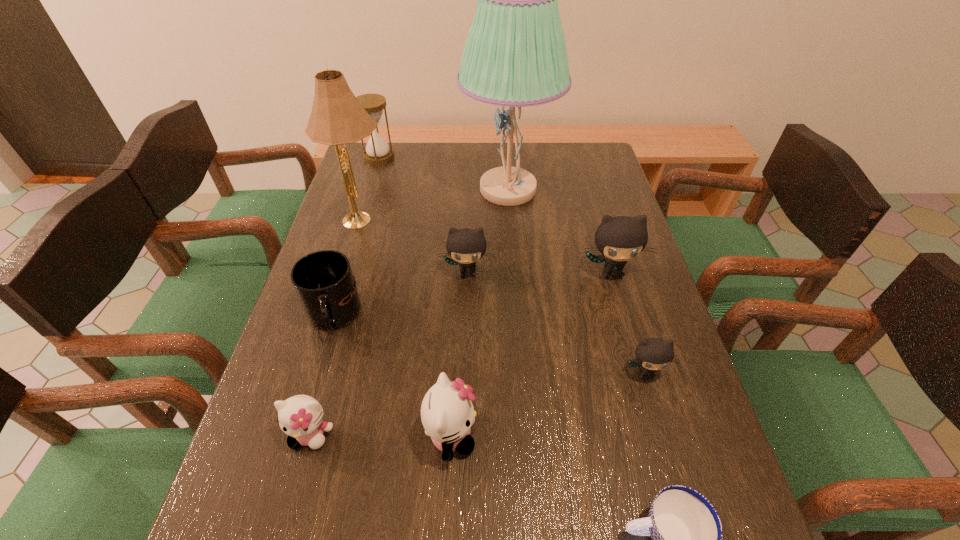
Where is `vacant region located with the handle on the side of the black mug`? vacant region located with the handle on the side of the black mug is located at coordinates (313, 384).

You are a GUI agent. You are given a task and a screenshot of the screen. Output one action in this format:
    pyautogui.click(x=<x>, y=<y>)
    Task: Click on the vacant space located on the front-facing side of the smaller white kitten
    
    Given the screenshot: What is the action you would take?
    pyautogui.click(x=297, y=485)

The height and width of the screenshot is (540, 960). In order to click on vacant space located on the front-facing side of the smallest gray kitten in this screenshot , I will do pos(660,425).

You are a GUI agent. You are given a task and a screenshot of the screen. Output one action in this format:
    pyautogui.click(x=<x>, y=<y>)
    Task: Click on the lamp positioned at the far edge
    This screenshot has height=540, width=960.
    Given the screenshot: What is the action you would take?
    pyautogui.click(x=515, y=55)

This screenshot has height=540, width=960. Identify the location of hourglass that is at the far edge. (377, 152).

Where is `lampshade present at the left edge`? The image size is (960, 540). lampshade present at the left edge is located at coordinates (337, 117).

Locate an element on the screen. The height and width of the screenshot is (540, 960). hourglass located at the left edge is located at coordinates (377, 152).

Image resolution: width=960 pixels, height=540 pixels. Identify the location of mug present at the left edge. (323, 280).

The width and height of the screenshot is (960, 540). I want to click on kitten situated at the left edge, so click(x=300, y=417).

The width and height of the screenshot is (960, 540). I want to click on object at the far left corner, so click(377, 152).